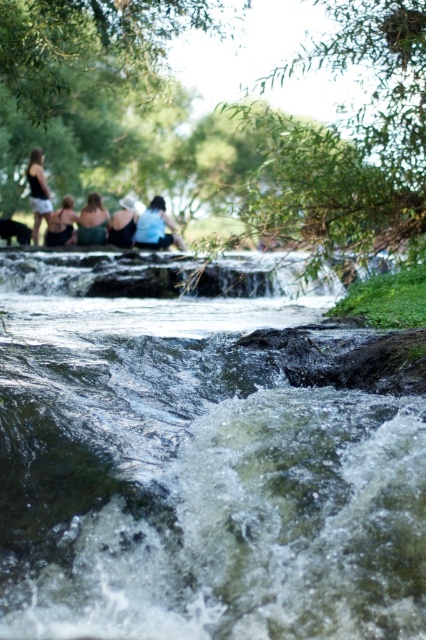
Can you confirm if white frothy water at center is positioned above matte black tank top at upper left?

No, white frothy water at center is not above matte black tank top at upper left.

In the scene shown: Who is shorter, white frothy water at center or matte black tank top at upper left?

Standing shorter between the two is white frothy water at center.

Who is more distant from viewer, (264, 356) or (69, 230)?

Positioned behind is point (69, 230).

I want to click on white frothy water at center, so click(x=193, y=474).

Is blue fabric shirt at center closer to the viewer compared to matte black tank top at left?

Yes, it is.

Does blue fabric shirt at center appear on the left side of matte black tank top at left?

Incorrect, blue fabric shirt at center is not on the left side of matte black tank top at left.

Which is in front, point (138, 241) or point (46, 195)?

Point (138, 241)

This screenshot has height=640, width=426. I want to click on blue fabric shirt at center, so click(155, 227).

The height and width of the screenshot is (640, 426). What do you see at coordinates (37, 192) in the screenshot?
I see `matte black tank top at left` at bounding box center [37, 192].

Is matte black tank top at left shorter than matte black tank top at upper left?

Incorrect, matte black tank top at left's height does not fall short of matte black tank top at upper left's.

Does point (36, 225) come in front of point (46, 237)?

No, it is behind (46, 237).

Find the location of `matte black tank top at left`. matte black tank top at left is located at coordinates (37, 192).